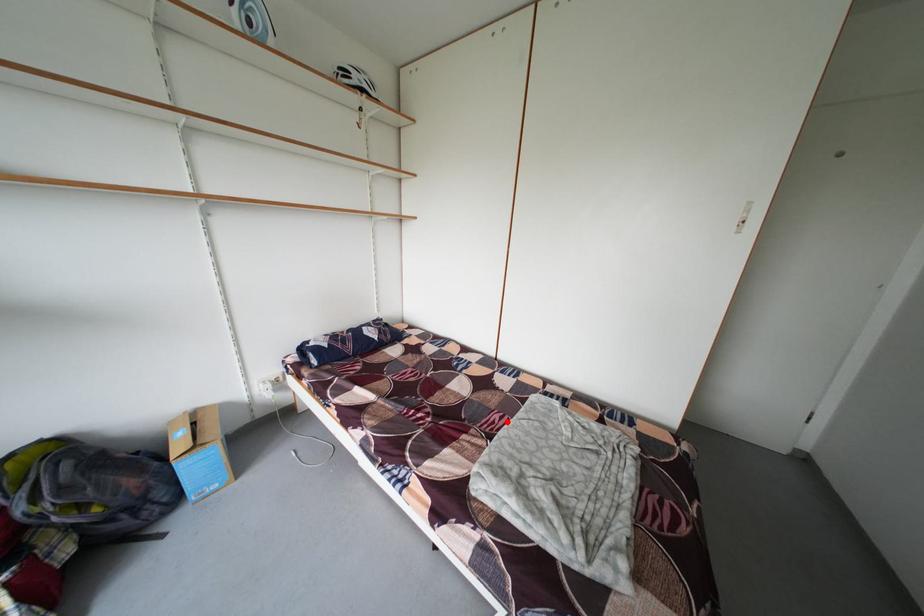
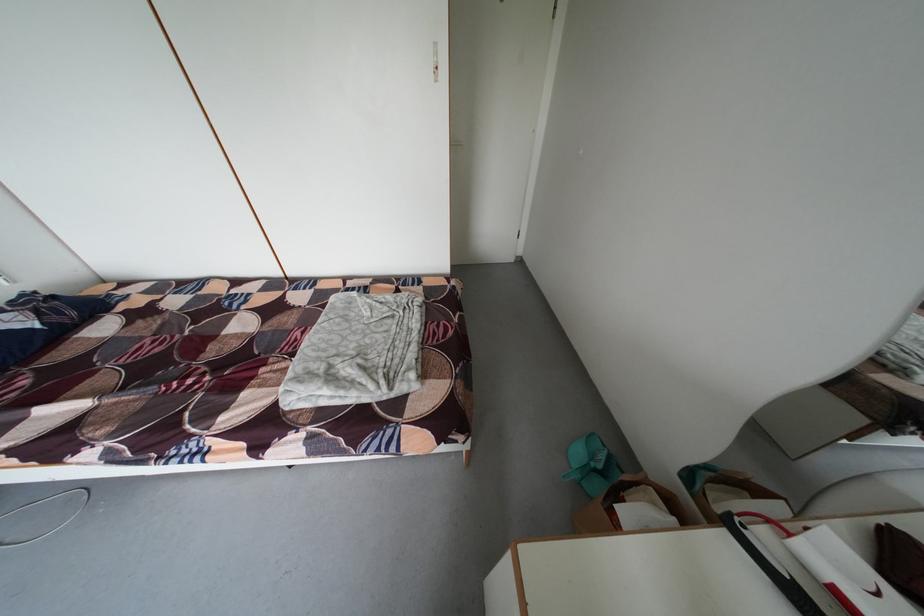
Where in the second image is the point corresponding to the highlighted location from the first image?

(309, 339)